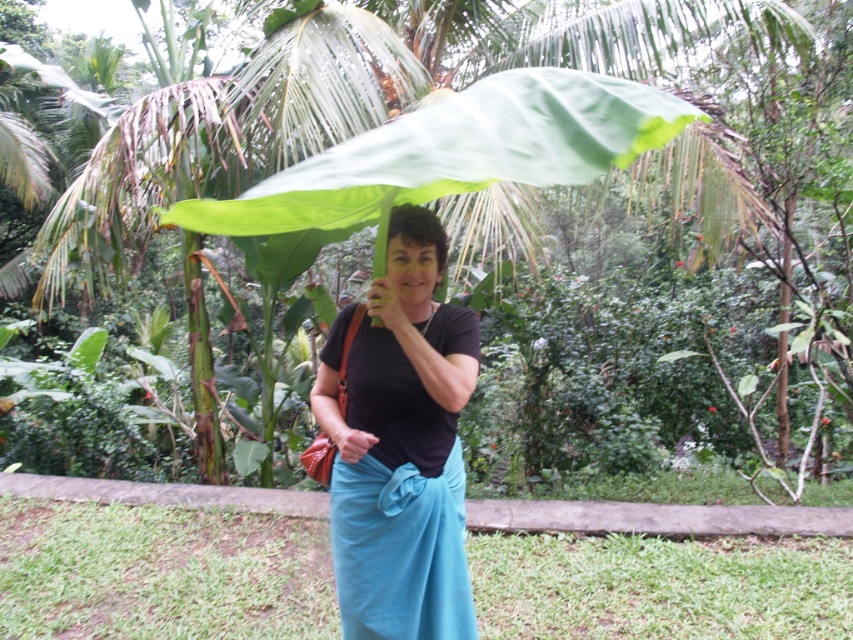
In the scene shown: You are a photographer trying to capture the black matte shirt at center and the green leafy umbrella at center in a single shot. Which object should you focus on first to ensure both are in focus?

You should focus on the black matte shirt at center first because it is closer to the viewer than the green leafy umbrella at center. By focusing on the closer object, the umbrella will also be in focus due to the depth of field.

You are standing in a tropical garden and see a person wearing a black matte shirt at center. If you want to hand them a drink without moving closer, what is the minimum length of the straw you need to reach them?

The black matte shirt at center and viewer are 1.95 meters apart from each other. Therefore, the minimum length of the straw needed to reach them without moving closer would be 1.95 meters.